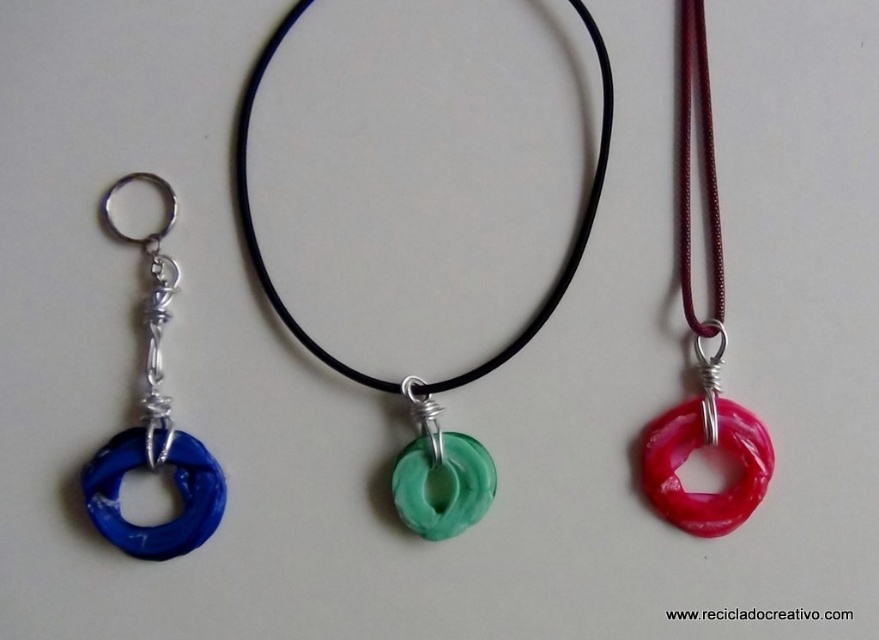
Question: Which of the following is the farthest from the observer?

Choices:
 (A) pink translucent ring at center
 (B) green translucent ring at center

Answer: (B)

Question: Estimate the real-world distances between objects in this image. Which object is closer to the green translucent ring at center?

Choices:
 (A) pink translucent ring at center
 (B) blue plastic ring at left
 (C) green rubbery ring at center

Answer: (C)

Question: Does green translucent ring at center have a lesser width compared to blue plastic ring at left?

Choices:
 (A) no
 (B) yes

Answer: (A)

Question: Can you confirm if green translucent ring at center is positioned to the right of green rubbery ring at center?

Choices:
 (A) yes
 (B) no

Answer: (A)

Question: Which point appears closest to the camera in this image?

Choices:
 (A) (401, 460)
 (B) (398, 481)

Answer: (B)

Question: Observing the image, what is the correct spatial positioning of pink translucent ring at center in reference to green rubbery ring at center?

Choices:
 (A) left
 (B) right

Answer: (B)